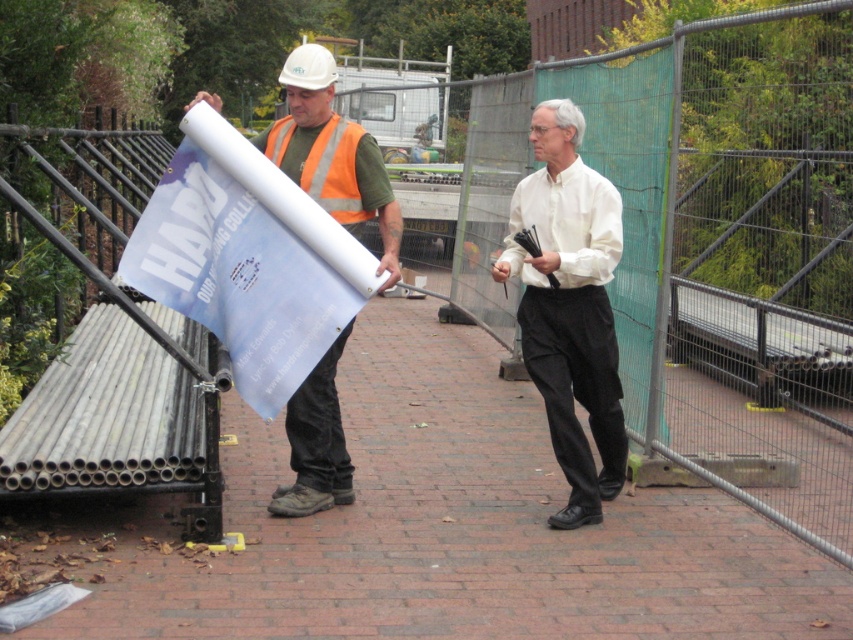
Question: Does matte white hard hat at center appear over orange reflective safety vest at center?

Choices:
 (A) no
 (B) yes

Answer: (A)

Question: In this image, where is white smooth shirt at center located relative to orange reflective safety vest at center?

Choices:
 (A) left
 (B) right

Answer: (B)

Question: Considering the real-world distances, which object is closest to the orange reflective safety vest at center?

Choices:
 (A) white smooth shirt at center
 (B) matte white hard hat at center

Answer: (B)

Question: Is matte white hard hat at center smaller than orange reflective safety vest at center?

Choices:
 (A) no
 (B) yes

Answer: (A)

Question: Based on their relative distances, which object is nearer to the orange reflective safety vest at center?

Choices:
 (A) matte white hard hat at center
 (B) white smooth shirt at center

Answer: (A)

Question: Which point is farther from the camera taking this photo?

Choices:
 (A) (300, 180)
 (B) (279, 145)
 (C) (570, 513)

Answer: (C)